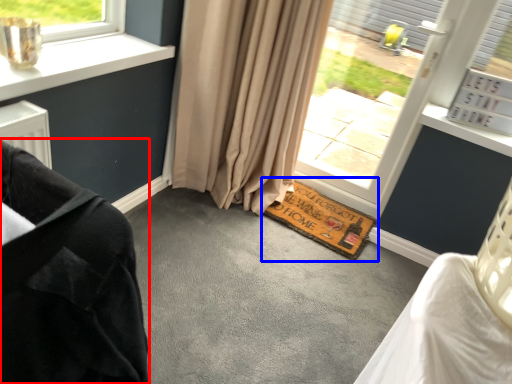
Question: Which point is further to the camera, furniture (highlighted by a red box) or doormat (highlighted by a blue box)?

Choices:
 (A) furniture
 (B) doormat

Answer: (B)